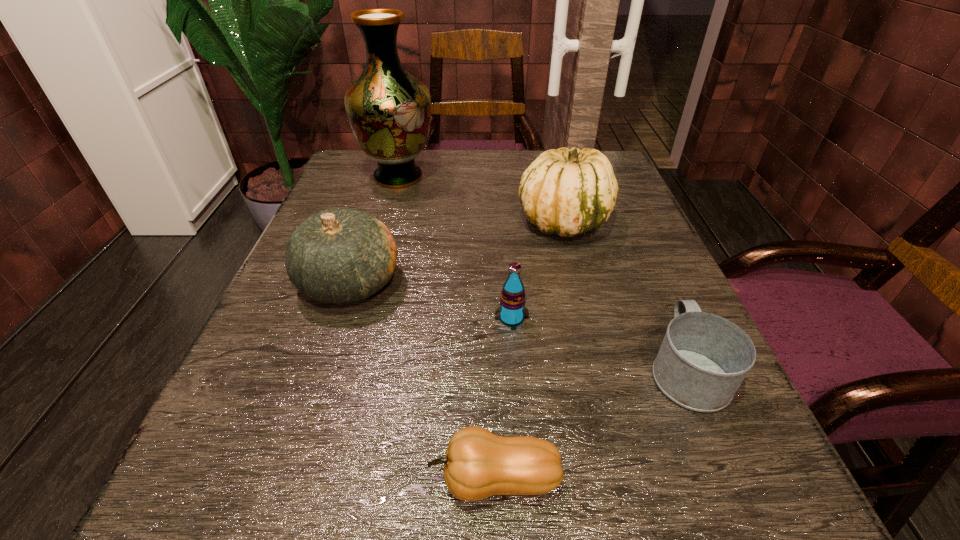
Locate an element on the screen. The height and width of the screenshot is (540, 960). vacant space located on the front of the fourth tallest object is located at coordinates (527, 525).

The height and width of the screenshot is (540, 960). I want to click on vacant region located 0.050m on the side of the mug with the handle, so click(x=660, y=309).

Identify the location of vacant space located on the side of the mug with the handle. The image size is (960, 540). (626, 228).

This screenshot has height=540, width=960. I want to click on vacant space located 0.070m on the side of the mug with the handle, so click(x=657, y=300).

Locate an element on the screen. Image resolution: width=960 pixels, height=540 pixels. free space located on the stem side of the shortest gourd is located at coordinates (334, 480).

This screenshot has height=540, width=960. What are the coordinates of `free space located 0.110m on the stem side of the shortest gourd` in the screenshot? It's located at (334, 480).

The height and width of the screenshot is (540, 960). Identify the location of free spot located on the stem side of the shortest gourd. (239, 480).

This screenshot has height=540, width=960. I want to click on vase present at the far edge, so click(x=389, y=110).

I want to click on gourd situated at the far edge, so click(567, 192).

You are a GUI agent. You are given a task and a screenshot of the screen. Output one action in this format:
    pyautogui.click(x=<x>, y=<y>)
    Task: Click on the object at the near edge
    
    Given the screenshot: What is the action you would take?
    [478, 464]